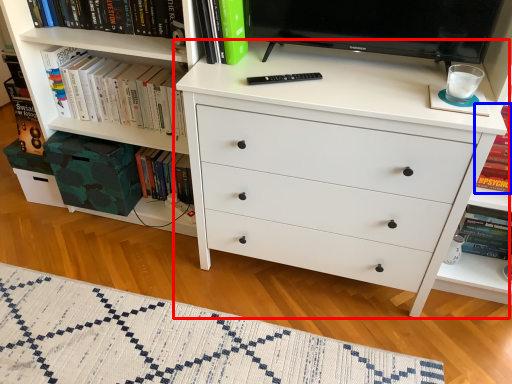
Question: Which point is closer to the camera, chest of drawers (highlighted by a red box) or book (highlighted by a blue box)?

Choices:
 (A) chest of drawers
 (B) book

Answer: (A)